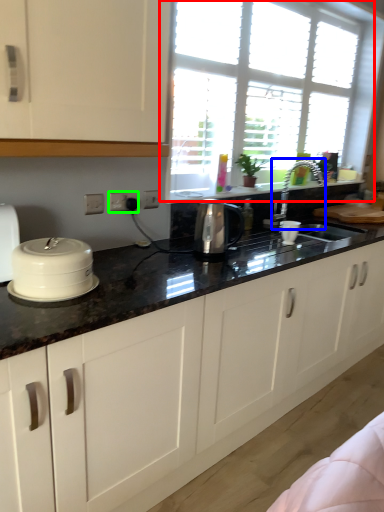
Question: Which is farther away from window (highlighted by a red box)? faucet (highlighted by a blue box) or electric outlet (highlighted by a green box)?

Choices:
 (A) faucet
 (B) electric outlet

Answer: (B)